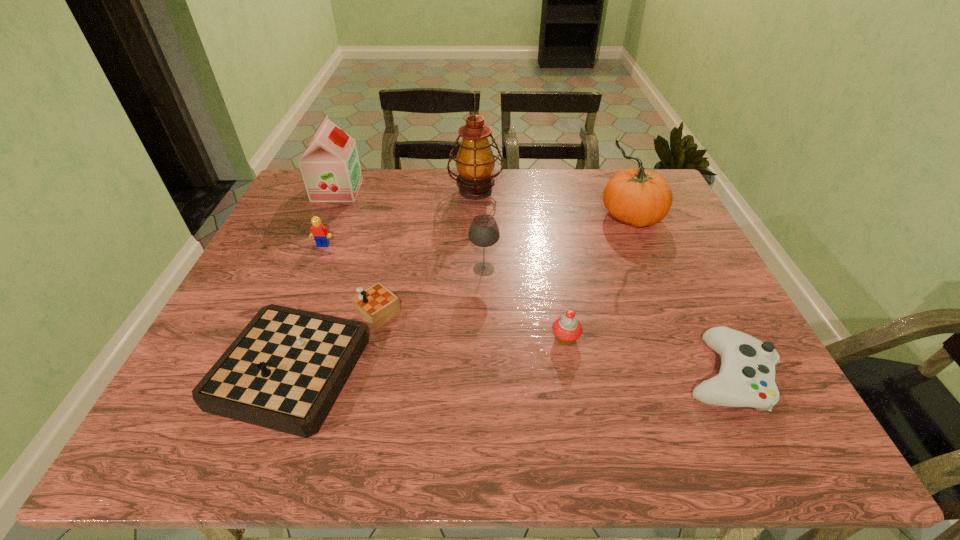
Find the location of `free space between the chessboard and the cupcake`. free space between the chessboard and the cupcake is located at coordinates (438, 348).

Where is `vacant space that is in between the second tallest object and the cupcake`? vacant space that is in between the second tallest object and the cupcake is located at coordinates (597, 278).

Identify the location of empty space that is in between the control and the oil lamp. (601, 283).

I want to click on vacant area that lies between the cupcake and the fifth shortest object, so click(x=525, y=304).

This screenshot has width=960, height=540. In order to click on vacant area between the chessboard and the cupcake in this screenshot , I will do `click(438, 348)`.

Image resolution: width=960 pixels, height=540 pixels. In order to click on free point between the control and the oil lamp in this screenshot , I will do `click(601, 283)`.

Select which object appears as the fourth closest to the pumpkin. Please provide its 2D coordinates. Your answer should be formatted as a tuple, i.e. [(x, y)], where the tuple contains the x and y coordinates of a point satisfying the conditions above.

[(746, 378)]

Find the location of a particular element. Image resolution: width=960 pixels, height=540 pixels. object identified as the fifth closest to the control is located at coordinates (475, 161).

Identify the location of free space that satisfies the following two spatial constraints: 1. on the back side of the cupcake; 2. on the left side of the chessboard. (316, 339).

Identify the location of vacant region that satisfies the following two spatial constraints: 1. on the face of the fourth farthest object; 2. on the right side of the chessboard. (276, 357).